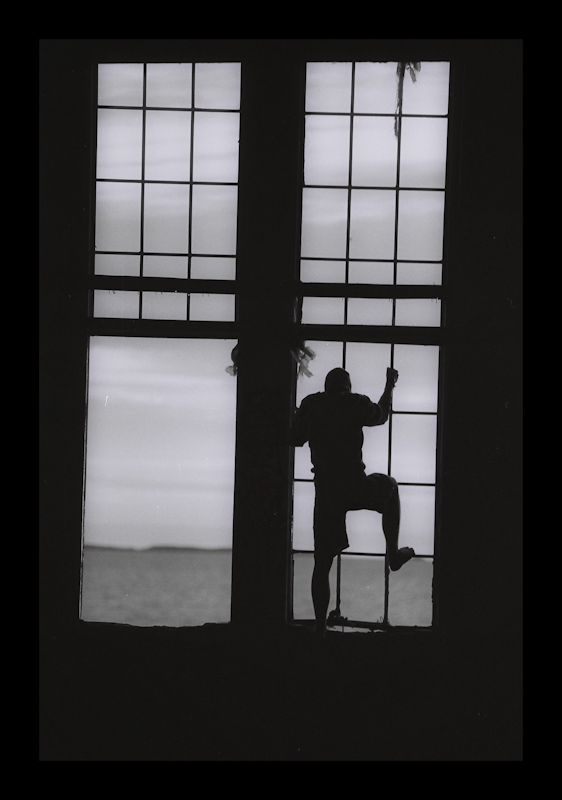
Locate an element on the screen. The height and width of the screenshot is (800, 562). open window is located at coordinates (174, 489).